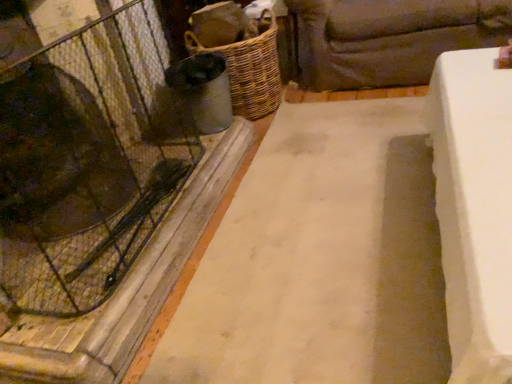
Where is `free spot in front of woven brown basket at center-left`? This screenshot has width=512, height=384. free spot in front of woven brown basket at center-left is located at coordinates 286,135.